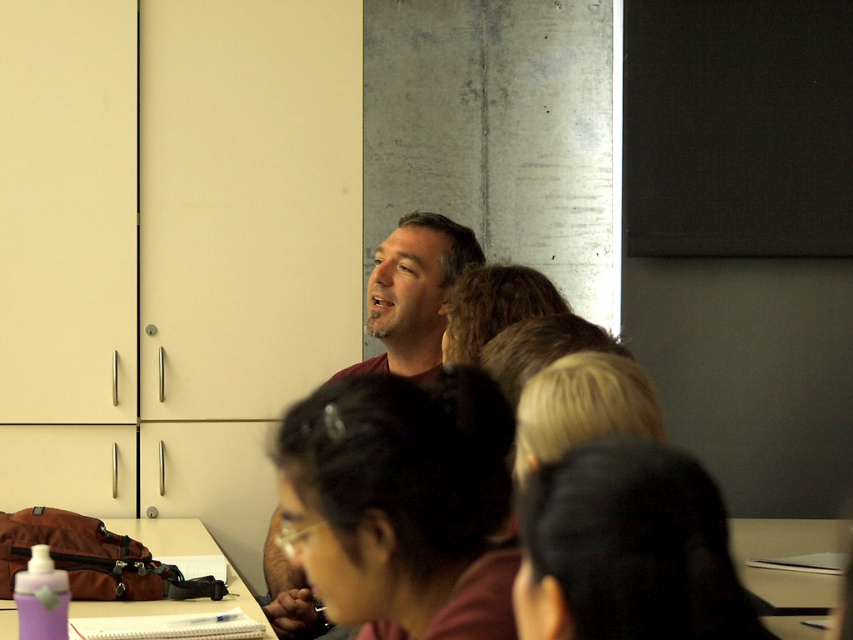
You are a student sitting at the desk in the classroom. You need to hand in your assignment to the instructor wearing the matte maroon shirt at center. However, you notice a purple plastic water bottle at lower left on your desk. Which object is closer to you when you are seated?

The purple plastic water bottle at lower left is closer to you because it is located at lower left on your desk, while the matte maroon shirt at center is positioned further away at the center of the room.

You are a student in the classroom and need to determine if your notebook can fit between the matte maroon shirt at center and the purple plastic water bottle at lower left. The notebook is 10 cm wide. Can it fit?

The matte maroon shirt at center is thinner than the purple plastic water bottle at lower left. The distance between them is not specified, so it is impossible to determine if the notebook can fit based on the given information.